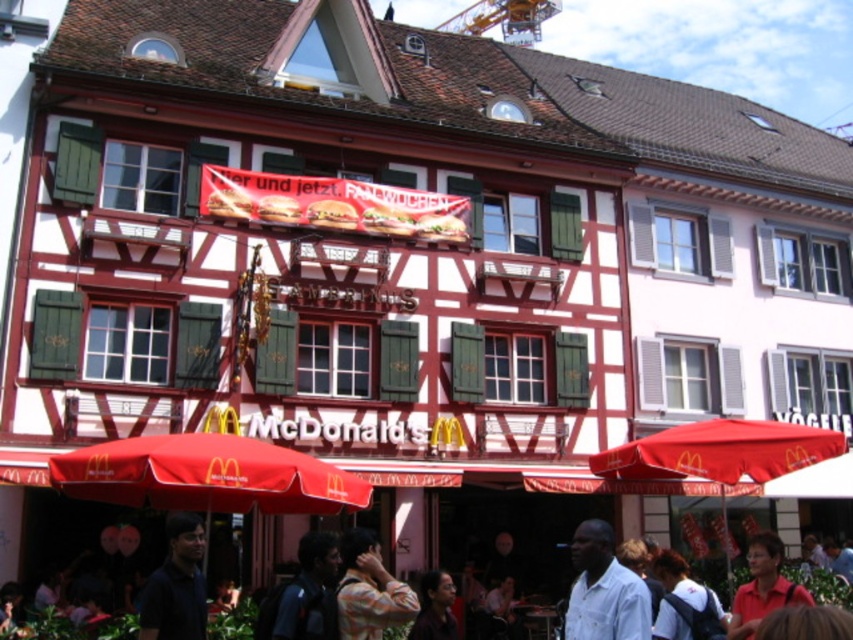
You are a customer entering the McDonalds restaurant and you notice two items at the entrance area. One is a dark blue shirt at lower center and the other is matte black glasses at center. Which item is shorter in height?

The dark blue shirt at lower center has a lesser height compared to matte black glasses at center, so the dark blue shirt at lower center is shorter in height.

You are a customer standing at the entrance of the McDonalds in the traditional building. You notice the matte red shirt at lower right and the yellow metallic crane at upper center. Which object is taller?

The yellow metallic crane at upper center is taller than the matte red shirt at lower right.

You are a customer standing at the entrance of the McDonalds in the half timbered building. You see a matte red shirt at lower right and a yellow metallic crane at upper center. Which object is closer to you?

The matte red shirt at lower right is positioned under the yellow metallic crane at upper center, meaning the yellow metallic crane at upper center is closer to you.